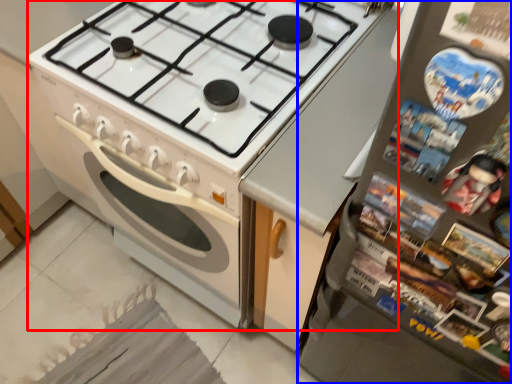
Question: Which point is closer to the camera, appliance (highlighted by a red box) or refrigerator (highlighted by a blue box)?

Choices:
 (A) appliance
 (B) refrigerator

Answer: (B)